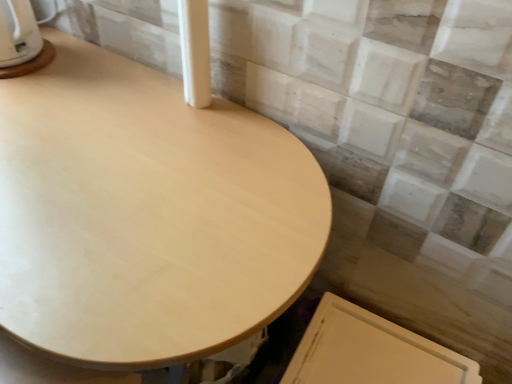
Question: From the image's perspective, is white glossy kettle at upper left located above or below white smooth pillar at upper center?

Choices:
 (A) above
 (B) below

Answer: (A)

Question: In the image, is white glossy kettle at upper left positioned in front of or behind white smooth pillar at upper center?

Choices:
 (A) behind
 (B) front

Answer: (A)

Question: Which object is positioned farthest from the light wood table at center?

Choices:
 (A) white glossy kettle at upper left
 (B) white smooth pillar at upper center

Answer: (A)

Question: Which is farther from the white glossy kettle at upper left?

Choices:
 (A) white smooth pillar at upper center
 (B) light wood table at center

Answer: (B)